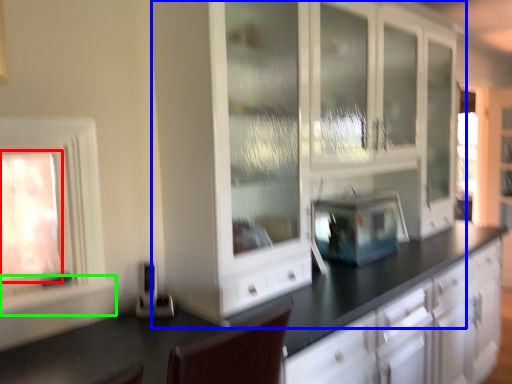
Question: Based on their relative distances, which object is farther from window (highlighted by a red box)? Choose from cabinetry (highlighted by a blue box) and window sill (highlighted by a green box).

Choices:
 (A) cabinetry
 (B) window sill

Answer: (A)